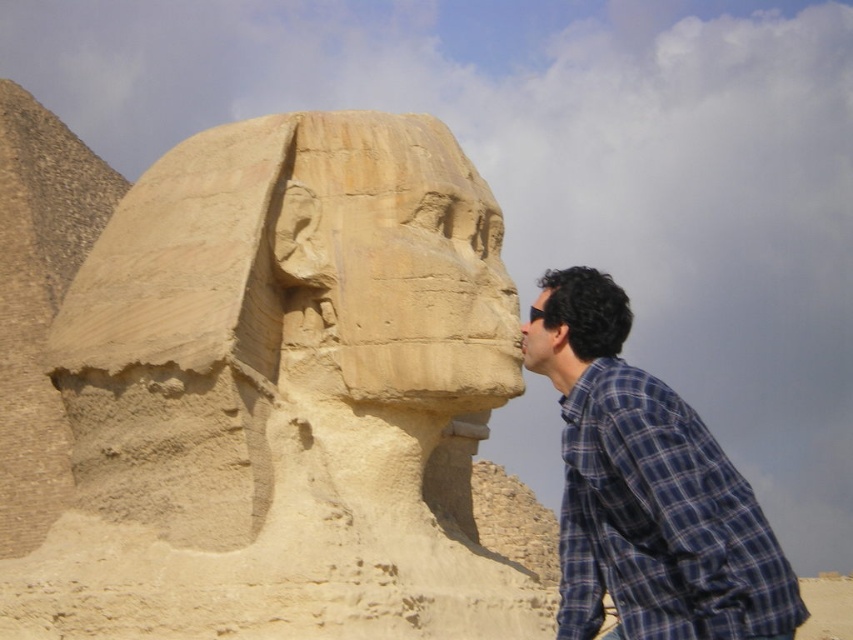
You are standing in front of the monumental stone sphinx sculpture. You see a blue plaid shirt at right and a matte stone nose at center. Which object is nearer to you?

The blue plaid shirt at right is closer to the viewer than the matte stone nose at center.